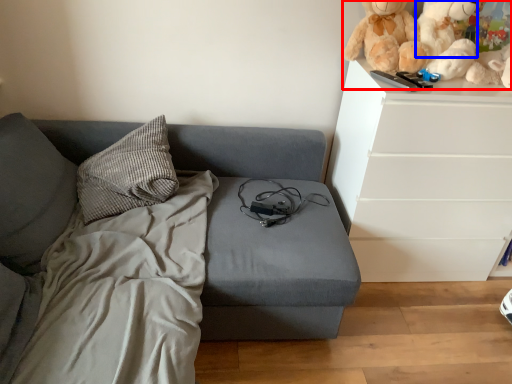
Question: Which point is closer to the camera, toy (highlighted by a red box) or teddy (highlighted by a blue box)?

Choices:
 (A) toy
 (B) teddy

Answer: (A)